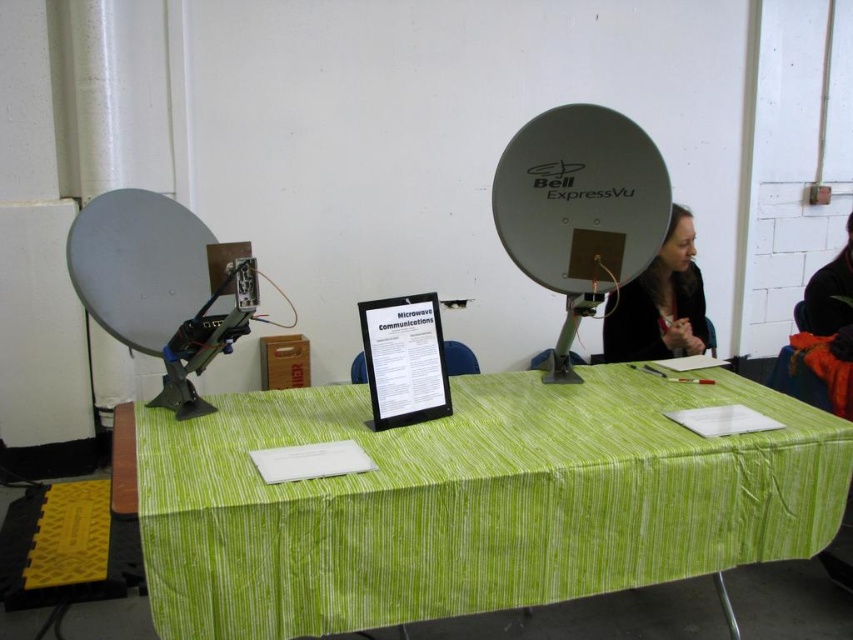
Question: In this image, where is green striped tablecloth at center located relative to smooth black hair at upper right?

Choices:
 (A) right
 (B) left

Answer: (B)

Question: Which point is closer to the camera?

Choices:
 (A) (628, 333)
 (B) (548, 580)

Answer: (B)

Question: Is green striped tablecloth at center positioned behind smooth black hair at upper right?

Choices:
 (A) no
 (B) yes

Answer: (A)

Question: From the image, what is the correct spatial relationship of green striped tablecloth at center in relation to smooth black hair at upper right?

Choices:
 (A) right
 (B) left

Answer: (B)